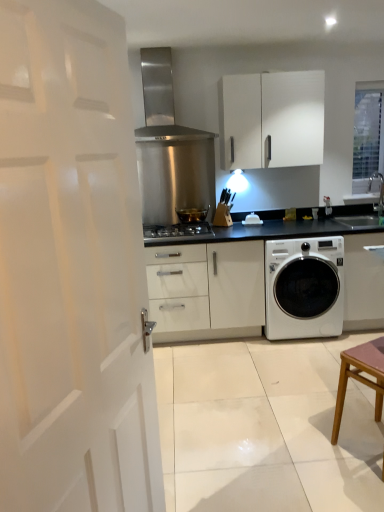
Measure the distance between point (x=338, y=404) and camera.

Point (x=338, y=404) is 2.29 meters away from camera.

Locate an element on the screen. white glossy sink at upper right is located at coordinates (365, 204).

Describe the element at coordinates (368, 134) in the screenshot. I see `clear glass window at upper right` at that location.

Describe the element at coordinates (178, 232) in the screenshot. The image size is (384, 512). I see `stainless steel gas stove at center` at that location.

You are a GUI agent. You are given a task and a screenshot of the screen. Output one action in this format:
    pyautogui.click(x=<x>, y=<y>)
    Task: Click on the white glossy washing machine at lower right
    The height and width of the screenshot is (512, 384).
    Given the screenshot: What is the action you would take?
    pyautogui.click(x=304, y=288)

The height and width of the screenshot is (512, 384). Describe the element at coordinates (192, 215) in the screenshot. I see `shiny metallic bowl at center` at that location.

Image resolution: width=384 pixels, height=512 pixels. Identify the location of brown wooden table at lower right. (360, 377).

Between brown wooden table at lower right and white glossy washing machine at lower right, which one has smaller width?

brown wooden table at lower right is thinner.

Is point (373, 359) closer to camera compared to point (278, 288)?

Yes, it is in front of point (278, 288).

Which of these two, brown wooden table at lower right or white glossy washing machine at lower right, stands taller?

white glossy washing machine at lower right.

Is brown wooden table at lower right positioned behind white glossy washing machine at lower right?

No, it is not.

Is white glossy sink at upper right far away from stainless steel gas stove at center?

Absolutely, white glossy sink at upper right is distant from stainless steel gas stove at center.

You are a GUI agent. You are given a task and a screenshot of the screen. Output one action in this format:
    pyautogui.click(x=<x>, y=<y>)
    Task: Click on the gas stove located below the white glossy sink at upper right (from the image's perspective)
    
    Given the screenshot: What is the action you would take?
    pyautogui.click(x=178, y=232)

Does white glossy sink at upper right have a smaller size compared to stainless steel gas stove at center?

No, white glossy sink at upper right is not smaller than stainless steel gas stove at center.

From the image's perspective, is white glossy sink at upper right on top of stainless steel gas stove at center?

Yes.

Is clear glass window at upper right to the left or to the right of stainless steel range hood at upper center in the image?

Clearly, clear glass window at upper right is on the right of stainless steel range hood at upper center in the image.

Does clear glass window at upper right have a lesser width compared to stainless steel range hood at upper center?

Yes.

Is clear glass window at upper right next to stainless steel range hood at upper center?

No.

Is clear glass window at upper right inside the boundaries of stainless steel range hood at upper center, or outside?

clear glass window at upper right cannot be found inside stainless steel range hood at upper center.

From the image's perspective, is stainless steel range hood at upper center on top of white matte cabinet at upper center?

Yes, from the image's perspective, stainless steel range hood at upper center is over white matte cabinet at upper center.

Find the location of a particular element. The image size is (384, 512). cabinetry that is under the stainless steel range hood at upper center (from a real-world perspective) is located at coordinates (271, 120).

From a real-world perspective, is stainless steel range hood at upper center on top of white matte cabinet at upper center?

Indeed, from a real-world perspective, stainless steel range hood at upper center stands above white matte cabinet at upper center.

From the picture: Does stainless steel range hood at upper center come in front of clear glass window at upper right?

Yes, stainless steel range hood at upper center is closer to the camera.

Is stainless steel range hood at upper center taller or shorter than clear glass window at upper right?

Clearly, stainless steel range hood at upper center is shorter compared to clear glass window at upper right.

Does point (144, 85) come in front of point (381, 135)?

Yes.

Is stainless steel range hood at upper center far from clear glass window at upper right?

Indeed, stainless steel range hood at upper center is not near clear glass window at upper right.

Is clear glass window at upper right thinner than shiny metallic bowl at center?

Correct, the width of clear glass window at upper right is less than that of shiny metallic bowl at center.

From the image's perspective, is clear glass window at upper right positioned above or below shiny metallic bowl at center?

Based on their image positions, clear glass window at upper right is located above shiny metallic bowl at center.

This screenshot has width=384, height=512. I want to click on appliance to the left of clear glass window at upper right, so (192, 215).

Considering their positions, is white glossy sink at upper right located in front of or behind stainless steel range hood at upper center?

white glossy sink at upper right is positioned farther from the viewer than stainless steel range hood at upper center.

From their relative heights in the image, would you say white glossy sink at upper right is taller or shorter than stainless steel range hood at upper center?

white glossy sink at upper right is shorter than stainless steel range hood at upper center.

From the image's perspective, does white glossy sink at upper right appear higher than stainless steel range hood at upper center?

No, from the image's perspective, white glossy sink at upper right is not over stainless steel range hood at upper center.

The image size is (384, 512). Identify the location of table in front of the white glossy washing machine at lower right. (360, 377).

You are a GUI agent. You are given a task and a screenshot of the screen. Output one action in this format:
    pyautogui.click(x=<x>, y=<y>)
    Task: Click on the gas stove below the white glossy sink at upper right (from the image's perspective)
    Image resolution: width=384 pixels, height=512 pixels.
    Given the screenshot: What is the action you would take?
    pyautogui.click(x=178, y=232)

Based on their spatial positions, is white matte door at left or stainless steel gas stove at center closer to white glossy washing machine at lower right?

stainless steel gas stove at center.

When comparing their distances from brown wooden table at lower right, does shiny metallic bowl at center or white matte cabinet at upper center seem further?

white matte cabinet at upper center is positioned further to the anchor brown wooden table at lower right.

When comparing their distances from white matte door at left, does white glossy washing machine at lower right or shiny metallic bowl at center seem closer?

The object closer to white matte door at left is white glossy washing machine at lower right.

From the image, which object appears to be farther from shiny metallic bowl at center, clear glass window at upper right or white matte door at left?

Based on the image, white matte door at left appears to be further to shiny metallic bowl at center.

Looking at the image, which one is located closer to brown wooden table at lower right, shiny metallic bowl at center or white glossy washing machine at lower right?

Among the two, white glossy washing machine at lower right is located nearer to brown wooden table at lower right.

Estimate the real-world distances between objects in this image. Which object is closer to white glossy sink at upper right, stainless steel gas stove at center or brown wooden table at lower right?

Among the two, stainless steel gas stove at center is located nearer to white glossy sink at upper right.

Which object lies further to the anchor point white matte cabinet at upper center, stainless steel gas stove at center or white glossy sink at upper right?

Among the two, white glossy sink at upper right is located further to white matte cabinet at upper center.

Estimate the real-world distances between objects in this image. Which object is further from shiny metallic bowl at center, stainless steel gas stove at center or brown wooden table at lower right?

brown wooden table at lower right is positioned further to the anchor shiny metallic bowl at center.

Find the location of a particular element. The height and width of the screenshot is (512, 384). appliance between white matte cabinet at upper center and white glossy washing machine at lower right in the up-down direction is located at coordinates (192, 215).

Where is `cabinetry between stainless steel gas stove at center and clear glass window at upper right in the horizontal direction`? cabinetry between stainless steel gas stove at center and clear glass window at upper right in the horizontal direction is located at coordinates (271, 120).

Image resolution: width=384 pixels, height=512 pixels. Identify the location of gas stove that lies between stainless steel range hood at upper center and white glossy washing machine at lower right from top to bottom. (178, 232).

At what (x,y) coordinates should I click in order to perform the action: click on sink between brown wooden table at lower right and clear glass window at upper right from front to back. Please return your answer as a coordinate pair (x, y). Looking at the image, I should click on [365, 204].